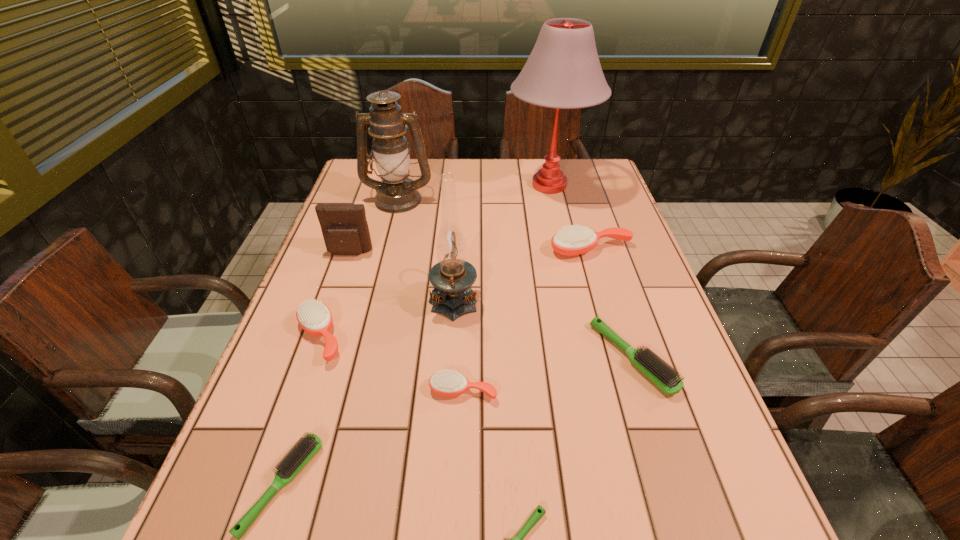
At what (x,y) coordinates should I click in order to perform the action: click on free region located 0.140m on the right of the sixth tallest object. Please return your answer as a coordinate pair (x, y). The image size is (960, 540). Looking at the image, I should click on (410, 336).

Where is `free region located on the left of the farthest light hairbrush`? The height and width of the screenshot is (540, 960). free region located on the left of the farthest light hairbrush is located at coordinates (440, 358).

The height and width of the screenshot is (540, 960). I want to click on free space located on the right of the nearest orange hairbrush, so click(648, 390).

Locate an element on the screen. table lamp at the far edge is located at coordinates (563, 71).

This screenshot has height=540, width=960. In order to click on oil lamp at the far edge in this screenshot , I will do `click(396, 193)`.

Find the location of a particular element. Image resolution: width=960 pixels, height=540 pixels. oil lamp present at the left edge is located at coordinates point(396,193).

The height and width of the screenshot is (540, 960). I want to click on pouch that is at the left edge, so click(x=345, y=230).

Identify the location of hairbrush situated at the left edge. The height and width of the screenshot is (540, 960). (314, 317).

Find the location of a particular element. This screenshot has width=960, height=540. table lamp at the right edge is located at coordinates (563, 71).

Identify the location of object that is at the far left corner. The height and width of the screenshot is (540, 960). (396, 193).